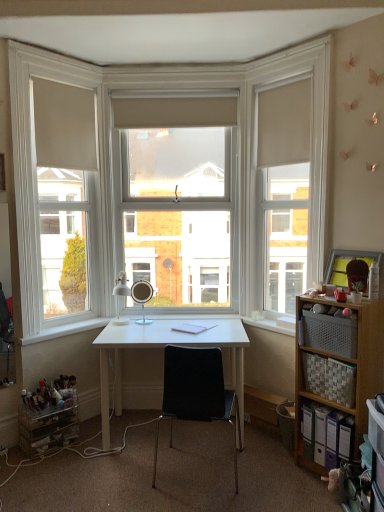
Question: Does satin silver mirror at center, which ranks as the second table lamp in left-to-right order, come behind matte white table lamp at center, arranged as the 2th table lamp when viewed from the right?

Choices:
 (A) yes
 (B) no

Answer: (A)

Question: Would you say matte white table lamp at center, arranged as the 2th table lamp when viewed from the right, is part of satin silver mirror at center, the first table lamp positioned from the right,'s contents?

Choices:
 (A) no
 (B) yes

Answer: (A)

Question: From a real-world perspective, is satin silver mirror at center, the first table lamp positioned from the right, on matte white table lamp at center, positioned as the 1th table lamp in left-to-right order?

Choices:
 (A) no
 (B) yes

Answer: (A)

Question: Considering the relative sizes of satin silver mirror at center, which ranks as the second table lamp in left-to-right order, and matte white table lamp at center, positioned as the 1th table lamp in left-to-right order, in the image provided, is satin silver mirror at center, which ranks as the second table lamp in left-to-right order, taller than matte white table lamp at center, positioned as the 1th table lamp in left-to-right order,?

Choices:
 (A) no
 (B) yes

Answer: (A)

Question: Is satin silver mirror at center, the first table lamp positioned from the right, thinner than matte white table lamp at center, arranged as the 2th table lamp when viewed from the right?

Choices:
 (A) no
 (B) yes

Answer: (B)

Question: Do you think woven fabric basket at right is within clear glass window at center, or outside of it?

Choices:
 (A) inside
 (B) outside

Answer: (B)

Question: Is woven fabric basket at right bigger or smaller than clear glass window at center?

Choices:
 (A) small
 (B) big

Answer: (A)

Question: Is woven fabric basket at right to the left or to the right of clear glass window at center in the image?

Choices:
 (A) right
 (B) left

Answer: (A)

Question: From a real-world perspective, relative to clear glass window at center, is woven fabric basket at right vertically above or below?

Choices:
 (A) below
 (B) above

Answer: (A)

Question: Does point (246, 274) appear closer or farther from the camera than point (304, 361)?

Choices:
 (A) closer
 (B) farther

Answer: (B)

Question: Is white wood frame at upper center, arranged as the second window frame when viewed from the left, taller or shorter than woven fabric basket at right, placed as the 2th shelf when sorted from bottom to top?

Choices:
 (A) tall
 (B) short

Answer: (A)

Question: Is white wood frame at upper center, marked as the first window frame in a right-to-left arrangement, wider or thinner than woven fabric basket at right, placed as the 2th shelf when sorted from bottom to top?

Choices:
 (A) wide
 (B) thin

Answer: (B)

Question: Based on their positions, is white wood frame at upper center, marked as the first window frame in a right-to-left arrangement, located to the left or right of woven fabric basket at right, the 1th shelf in the top-to-bottom sequence?

Choices:
 (A) left
 (B) right

Answer: (A)

Question: In terms of width, does white matte window frame at left, marked as the 2th window frame in a right-to-left arrangement, look wider or thinner when compared to clear glass window at center?

Choices:
 (A) wide
 (B) thin

Answer: (A)

Question: Is white matte window frame at left, the first window frame from the left, to the left or to the right of clear glass window at center in the image?

Choices:
 (A) right
 (B) left

Answer: (B)